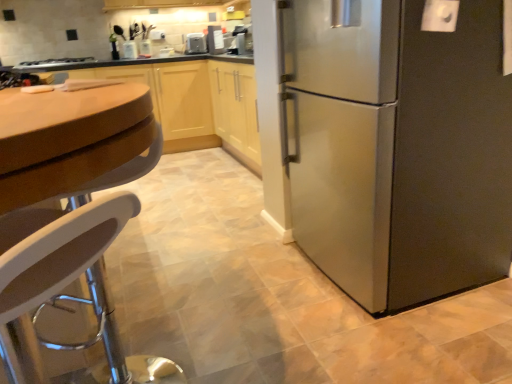
Question: From the image's perspective, relative to satin silver stove at upper left, is satin silver refrigerator at right above or below?

Choices:
 (A) below
 (B) above

Answer: (A)

Question: Is satin silver refrigerator at right in front of or behind satin silver stove at upper left in the image?

Choices:
 (A) behind
 (B) front

Answer: (B)

Question: Which is farther from the satin silver stove at upper left?

Choices:
 (A) white plastic stool at lower left
 (B) satin black coffee maker at upper center, the 2th appliance in the back-to-front sequence
 (C) satin silver refrigerator at right
 (D) wooden cabinet at center
 (E) metallic silver toaster at upper center, positioned as the 1th appliance in left-to-right order

Answer: (A)

Question: Which object is positioned closest to the satin silver stove at upper left?

Choices:
 (A) metallic silver toaster at upper center, placed as the second appliance when sorted from right to left
 (B) satin silver refrigerator at right
 (C) satin black coffee maker at upper center, which appears as the 1th appliance when viewed from the front
 (D) wooden cabinet at center
 (E) white plastic stool at lower left

Answer: (D)